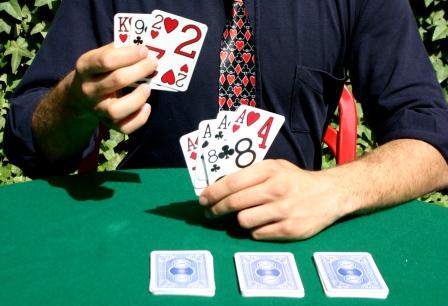
I want to click on chair, so click(x=208, y=70).